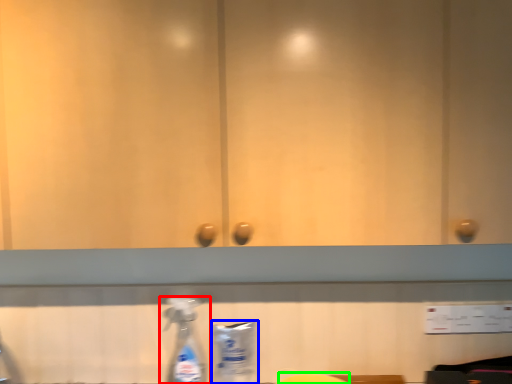
Question: Which is nearer to the bottle (highlighted by a red box)? cleaning product (highlighted by a blue box) or wide (highlighted by a green box).

Choices:
 (A) cleaning product
 (B) wide

Answer: (A)